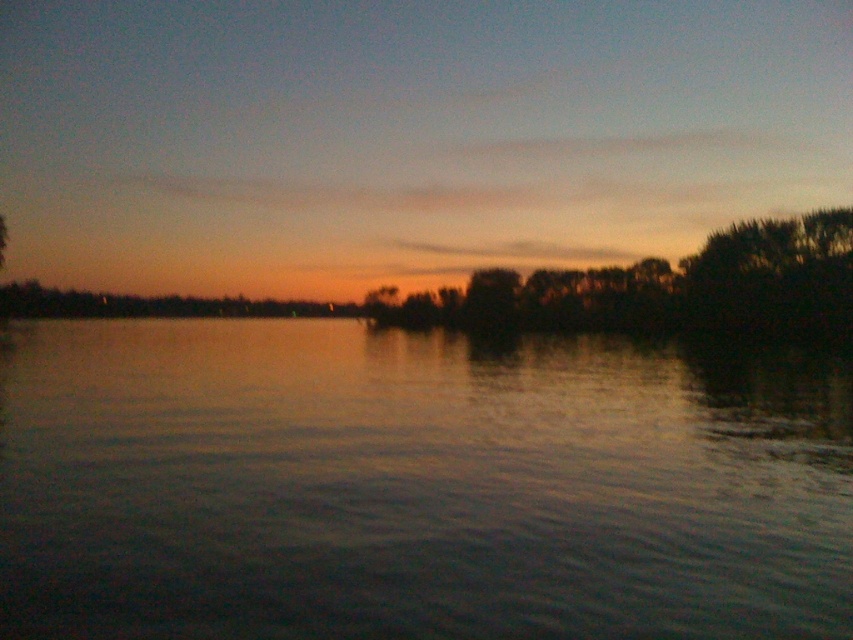
Can you confirm if smooth water at center is positioned to the left of dark green leafy tree at right?

Indeed, smooth water at center is positioned on the left side of dark green leafy tree at right.

Does smooth water at center have a greater width compared to dark green leafy tree at right?

Indeed, smooth water at center has a greater width compared to dark green leafy tree at right.

Between point (492, 490) and point (775, 234), which one is positioned behind?

Positioned behind is point (775, 234).

You are a GUI agent. You are given a task and a screenshot of the screen. Output one action in this format:
    pyautogui.click(x=<x>, y=<y>)
    Task: Click on the smooth water at center
    This screenshot has height=640, width=853.
    Given the screenshot: What is the action you would take?
    pyautogui.click(x=415, y=484)

Image resolution: width=853 pixels, height=640 pixels. Identify the location of smooth water at center. (415, 484).

Which is below, smooth water at center or dark green leafy trees at center?

smooth water at center

The image size is (853, 640). What do you see at coordinates (415, 484) in the screenshot? I see `smooth water at center` at bounding box center [415, 484].

Image resolution: width=853 pixels, height=640 pixels. In order to click on smooth water at center in this screenshot , I will do `click(415, 484)`.

Is dark green leafy trees at center positioned before dark green leafy tree at right?

Yes, it is in front of dark green leafy tree at right.

Where is `dark green leafy trees at center`? dark green leafy trees at center is located at coordinates (666, 289).

Who is more forward, (x=595, y=314) or (x=734, y=307)?

Point (x=734, y=307) is in front.

At what (x,y) coordinates should I click in order to perform the action: click on dark green leafy trees at center. Please return your answer as a coordinate pair (x, y). This screenshot has height=640, width=853. Looking at the image, I should click on (666, 289).